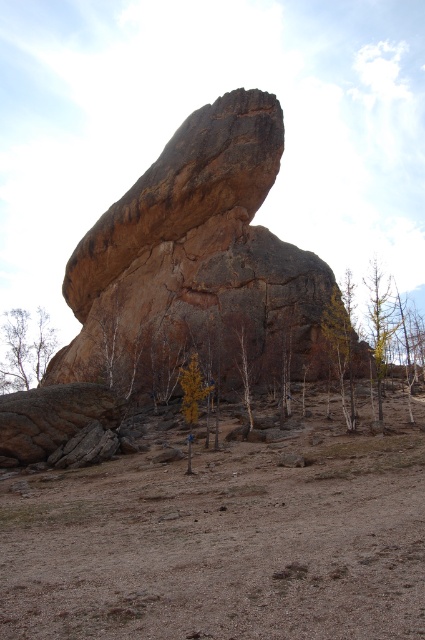
Question: Does rusty rock at lower left have a greater width compared to yellow leafy tree at center?

Choices:
 (A) yes
 (B) no

Answer: (A)

Question: Observing the image, what is the correct spatial positioning of brown rough rock at center in reference to brown bark tree at lower left?

Choices:
 (A) below
 (B) above

Answer: (B)

Question: Among these points, which one is farthest from the camera?

Choices:
 (A) (418, 602)
 (B) (249, 369)
 (C) (10, 387)
 (D) (221, 136)

Answer: (C)

Question: From the image, what is the correct spatial relationship of brown sandy dirt field at lower center in relation to brown rough rock at center?

Choices:
 (A) right
 (B) left

Answer: (A)

Question: Which is nearer to the yellow-green wood at right?

Choices:
 (A) brown bark tree at lower left
 (B) brown rough rock at center
 (C) yellow leafy tree at center

Answer: (C)

Question: Which point is closer to the camera taking this photo?

Choices:
 (A) (14, 364)
 (B) (377, 339)

Answer: (B)